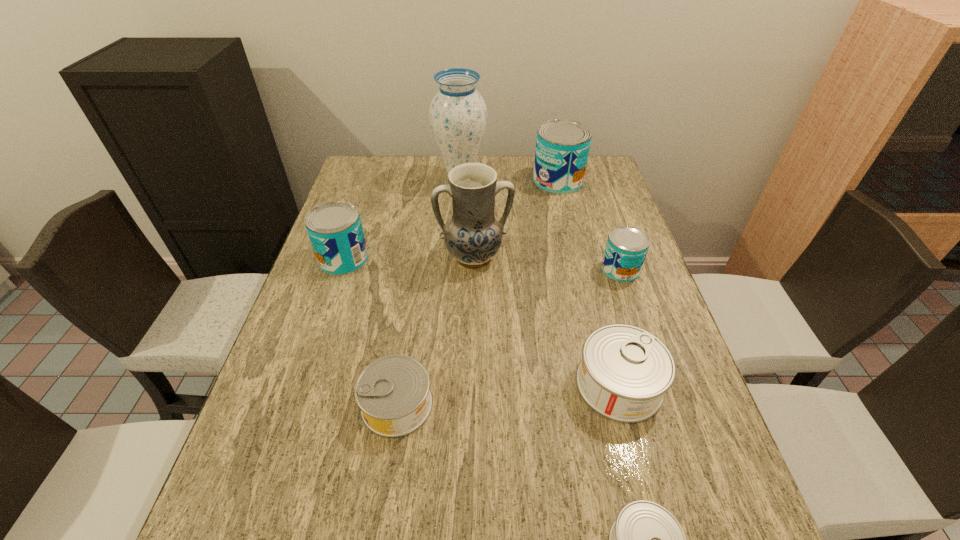
You are a GUI agent. You are given a task and a screenshot of the screen. Output one action in this format:
    pyautogui.click(x=<x>, y=<y>)
    Task: Click on the vacant region between the farthest can and the blue pottery
    
    Given the screenshot: What is the action you would take?
    pyautogui.click(x=516, y=219)

You are a GUI agent. You are given a task and a screenshot of the screen. Output one action in this format:
    pyautogui.click(x=<x>, y=<y>)
    Task: Click on the free space between the leftmost silver can and the smallest blue can
    
    Given the screenshot: What is the action you would take?
    pyautogui.click(x=509, y=337)

Locate an element on the screen. empty space that is in between the sixth shortest object and the smallest blue can is located at coordinates (589, 225).

This screenshot has height=540, width=960. In order to click on vacant space in between the smallest blue can and the blue pottery in this screenshot , I will do `click(547, 264)`.

Image resolution: width=960 pixels, height=540 pixels. I want to click on unoccupied position between the smallest blue can and the tallest object, so click(540, 225).

Image resolution: width=960 pixels, height=540 pixels. Identify the location of empty space that is in between the biggest silver can and the second biggest blue can. (481, 321).

Choose which object is the fourth nearest neighbor to the vase. Please provide its 2D coordinates. Your answer should be formatted as a tuple, i.e. [(x, y)], where the tuple contains the x and y coordinates of a point satisfying the conditions above.

[(626, 248)]

Locate which object ranks seventh in proximity to the biggest blue can. Please provide its 2D coordinates. Your answer should be formatted as a tuple, i.e. [(x, y)], where the tuple contains the x and y coordinates of a point satisfying the conditions above.

[(646, 539)]

Locate which can is the fourth closest to the smallest blue can. Please provide its 2D coordinates. Your answer should be formatted as a tuple, i.e. [(x, y)], where the tuple contains the x and y coordinates of a point satisfying the conditions above.

[(646, 539)]

I want to click on can that stands as the closest to the leftmost silver can, so click(625, 371).